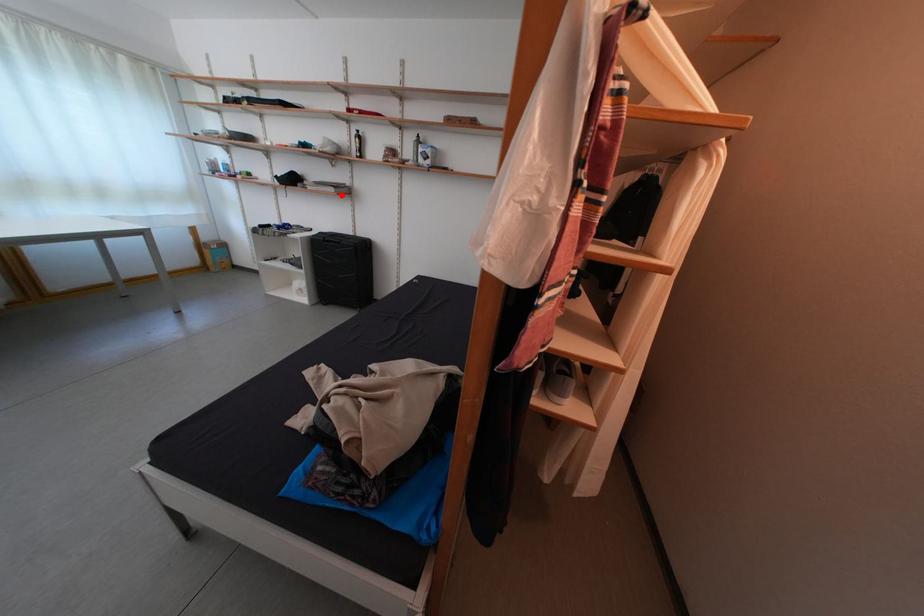
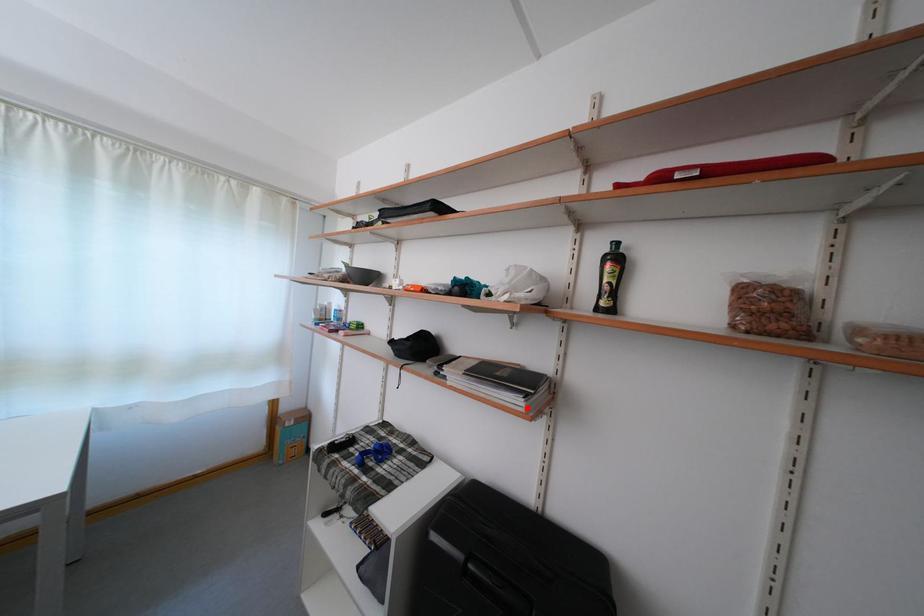
I am providing you with two images of the same scene from different viewpoints. A red point is marked on the first image and another point is marked on the second image. Is the red point in image1 aligned with the point shown in image2?

Yes